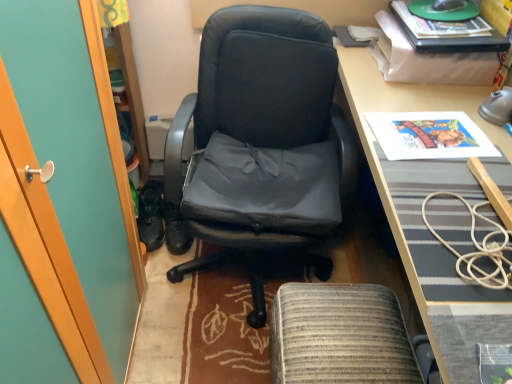
Question: From the image's perspective, is wooden desk at center above or below black leather chair at center?

Choices:
 (A) above
 (B) below

Answer: (B)

Question: Looking at the image, does wooden desk at center seem bigger or smaller compared to black leather chair at center?

Choices:
 (A) small
 (B) big

Answer: (B)

Question: Based on their relative distances, which object is farther from the wooden desk at center?

Choices:
 (A) woven fabric footrest at lower center
 (B) black leather shoes at lower left
 (C) printed paper poster at upper right
 (D) black leather chair at center
 (E) black plastic mouse at upper right

Answer: (B)

Question: Estimate the real-world distances between objects in this image. Which object is closer to the printed paper poster at upper right?

Choices:
 (A) black leather shoes at lower left
 (B) wooden desk at center
 (C) black leather chair at center
 (D) black plastic mouse at upper right
 (E) woven fabric footrest at lower center

Answer: (B)